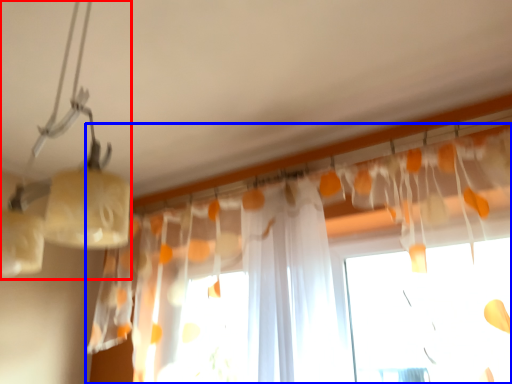
Question: Which of the following is the farthest to the observer, lamp (highlighted by a red box) or curtain (highlighted by a blue box)?

Choices:
 (A) lamp
 (B) curtain

Answer: (B)